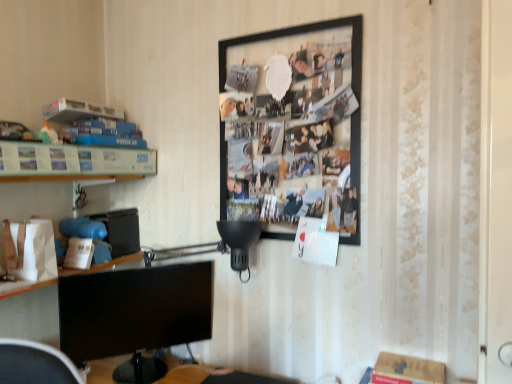
Question: Considering the positions of black matte picture frame at upper center and black glossy monitor at lower left in the image, is black matte picture frame at upper center bigger or smaller than black glossy monitor at lower left?

Choices:
 (A) big
 (B) small

Answer: (A)

Question: From a real-world perspective, is black matte picture frame at upper center physically located above or below black glossy monitor at lower left?

Choices:
 (A) below
 (B) above

Answer: (B)

Question: Which is nearer to the metallic silver frame at left?

Choices:
 (A) black matte picture frame at upper center
 (B) black glossy monitor at lower left

Answer: (B)

Question: Estimate the real-world distances between objects in this image. Which object is closer to the black matte picture frame at upper center?

Choices:
 (A) black glossy monitor at lower left
 (B) metallic silver frame at left

Answer: (A)